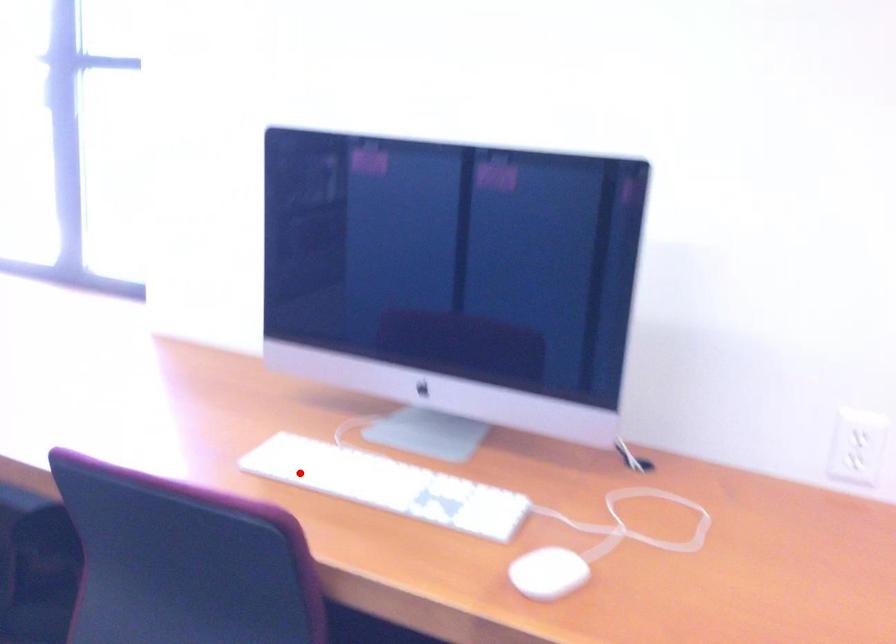
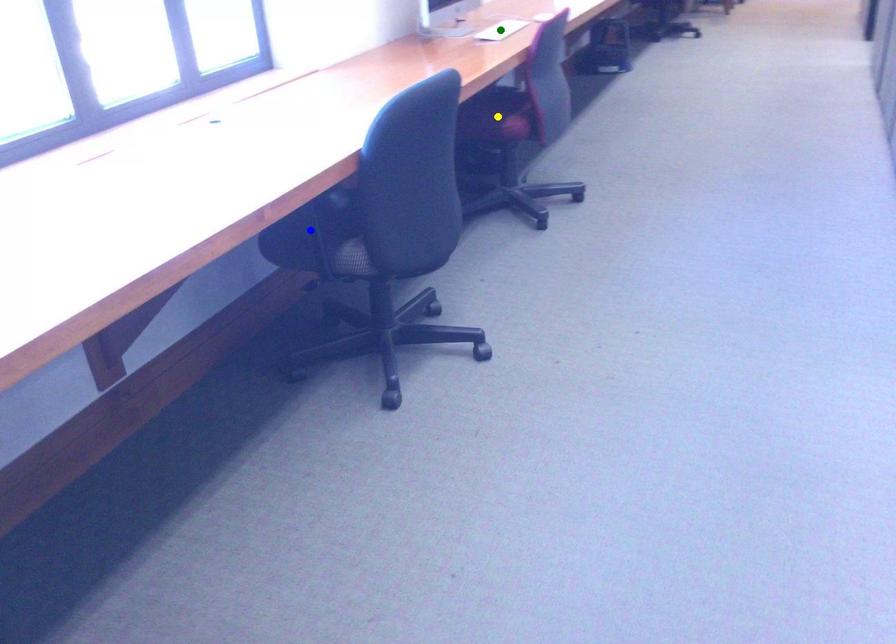
Question: I am providing you with two images of the same scene from different viewpoints. A red point is marked on the first image. You are given multiple points on the second image. Which mark in image 2 goes with the point in image 1?

Choices:
 (A) yellow point
 (B) blue point
 (C) green point

Answer: (C)